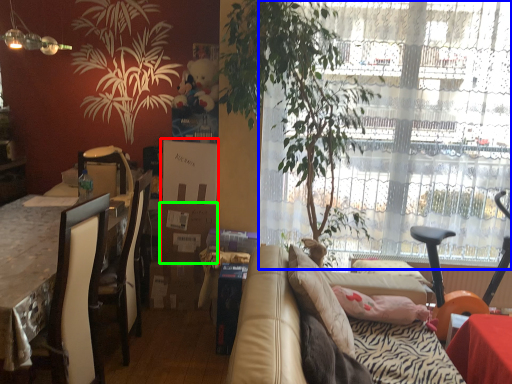
Question: Which object is the farthest from box (highlighted by a red box)? Choose among these: window (highlighted by a blue box) or cardboard box (highlighted by a green box).

Choices:
 (A) window
 (B) cardboard box

Answer: (A)